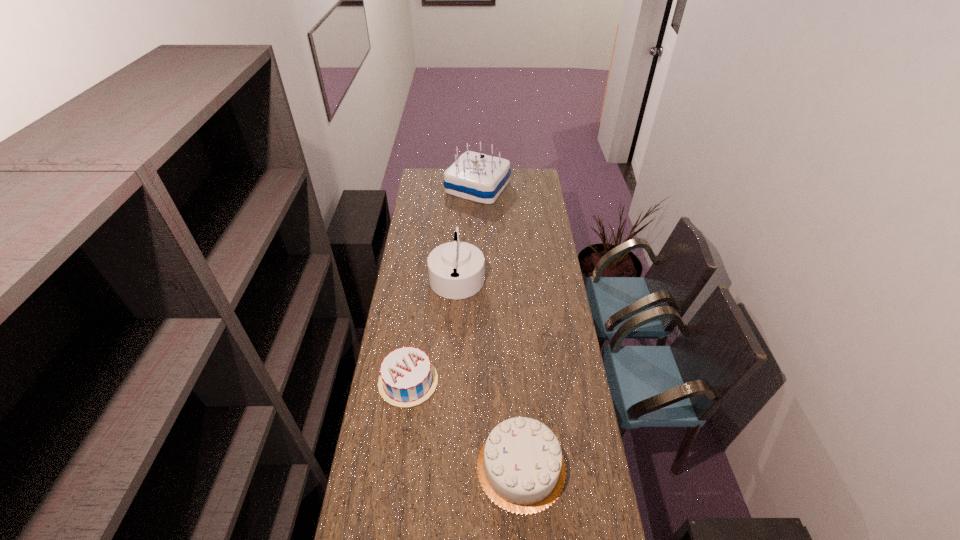
You are a GUI agent. You are given a task and a screenshot of the screen. Output one action in this format:
    pyautogui.click(x=<x>, y=<y>)
    Task: Click on the vacant space in between the third shortest object and the second nearest birthday cake
    The width and height of the screenshot is (960, 540).
    Given the screenshot: What is the action you would take?
    pyautogui.click(x=433, y=328)

The height and width of the screenshot is (540, 960). What are the coordinates of `empty location between the third tallest object and the farthest object` in the screenshot? It's located at (499, 327).

Where is `unoccupied area between the farthest object and the second shortest object`? This screenshot has height=540, width=960. unoccupied area between the farthest object and the second shortest object is located at coordinates (499, 327).

The width and height of the screenshot is (960, 540). Identify the location of free space between the second farthest object and the nearest object. (490, 371).

The height and width of the screenshot is (540, 960). I want to click on free area in between the second farthest object and the shortest birthday cake, so click(433, 328).

Find the location of `vacant space that is in between the second farthest object and the second nearest birthday cake`. vacant space that is in between the second farthest object and the second nearest birthday cake is located at coordinates (433, 328).

This screenshot has width=960, height=540. Identify the location of free spot between the nearest birthday cake and the second tallest object. (490, 371).

You are a GUI agent. You are given a task and a screenshot of the screen. Output one action in this format:
    pyautogui.click(x=<x>, y=<y>)
    Task: Click on the free space between the farthest object and the third tallest object
    
    Given the screenshot: What is the action you would take?
    pyautogui.click(x=499, y=327)

Where is `object that is the nearest to the shortest object`? The image size is (960, 540). object that is the nearest to the shortest object is located at coordinates (521, 468).

Locate which object is the closest to the second farthest object. Please provide its 2D coordinates. Your answer should be formatted as a tuple, i.e. [(x, y)], where the tuple contains the x and y coordinates of a point satisfying the conditions above.

[(407, 378)]